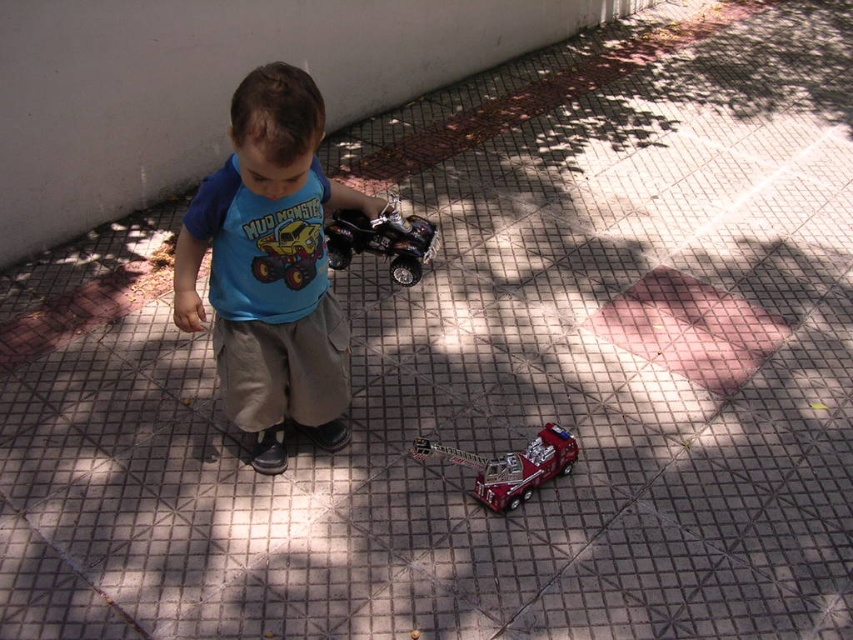
You are a parent trying to decide which item to pick up first. The blue cotton shirt at center is bigger than the shiny metallic quad bike at center. Which item takes up more space on the ground?

The blue cotton shirt at center takes up more space on the ground because it is bigger than the shiny metallic quad bike at center.